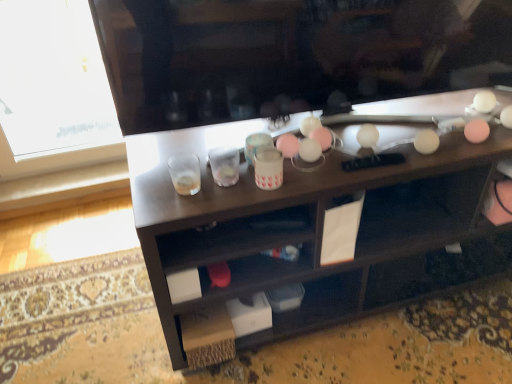
You are a GUI agent. You are given a task and a screenshot of the screen. Output one action in this format:
    pyautogui.click(x=<x>, y=<y>)
    Task: Click on the vacant region to the left of translucent glass at center, placed as the first shot glass when sorted from left to right
    This screenshot has width=512, height=384.
    Given the screenshot: What is the action you would take?
    (x=150, y=185)